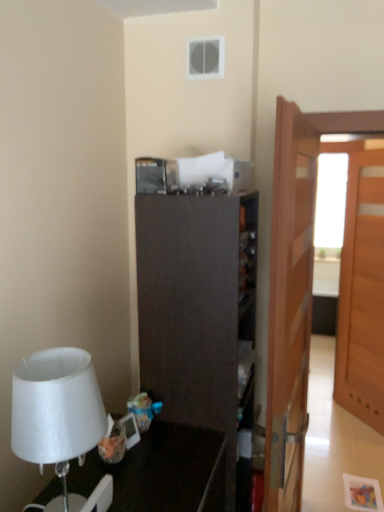
Where is `space that is in front of light brown wooden door at right, arranged as the 1th door when viewed from the right`? space that is in front of light brown wooden door at right, arranged as the 1th door when viewed from the right is located at coordinates (360, 443).